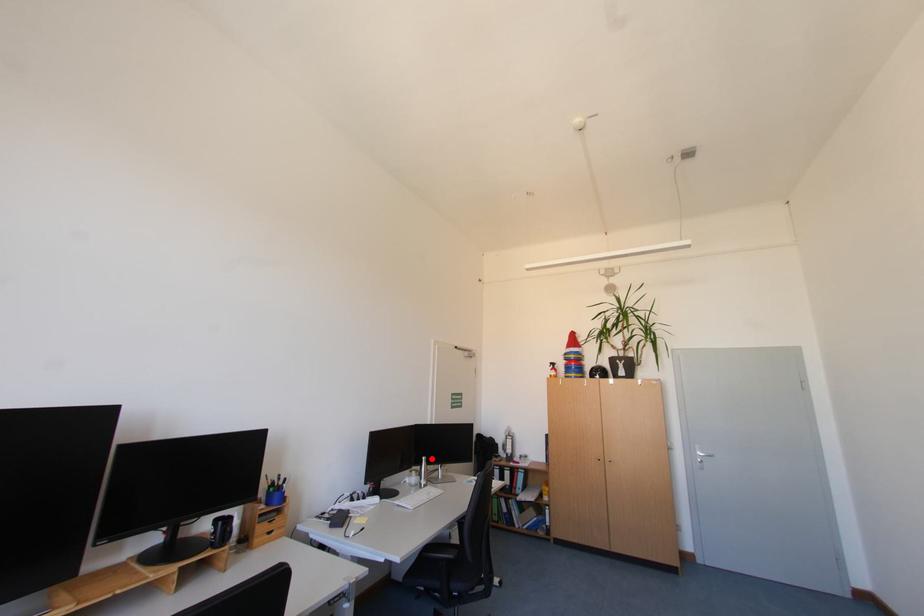
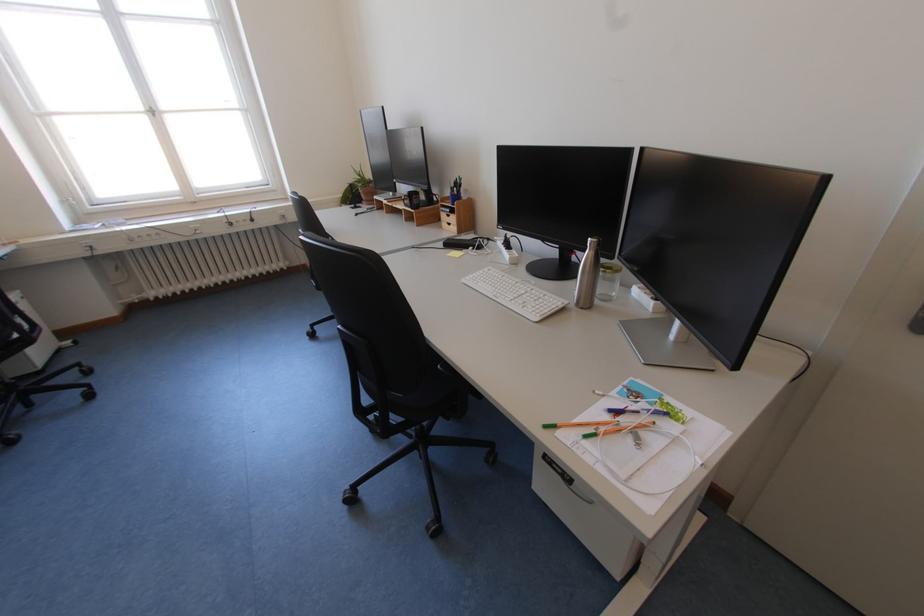
Question: I am providing you with two images of the same scene from different viewpoints. In image1, a red point is highlighted. Considering the same 3D point in image2, which of the following is correct?

Choices:
 (A) It is closer
 (B) It is farther

Answer: (A)